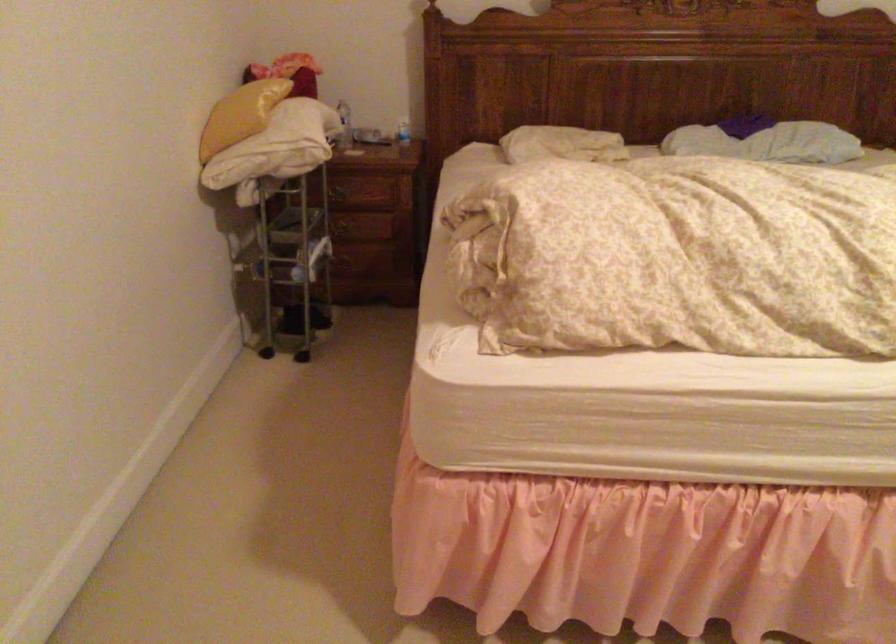
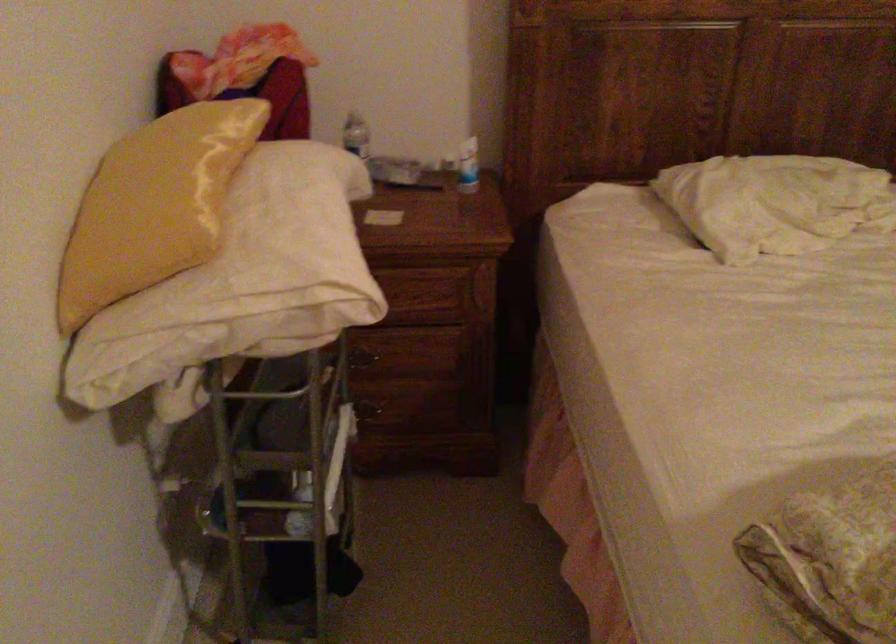
The point at [243,109] is marked in the first image. Where is the corresponding point in the second image?

(153, 205)